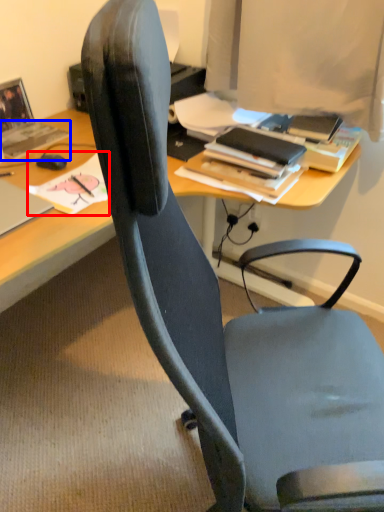
Question: Which object is further to the camera taking this photo, book (highlighted by a red box) or book (highlighted by a blue box)?

Choices:
 (A) book
 (B) book

Answer: (B)